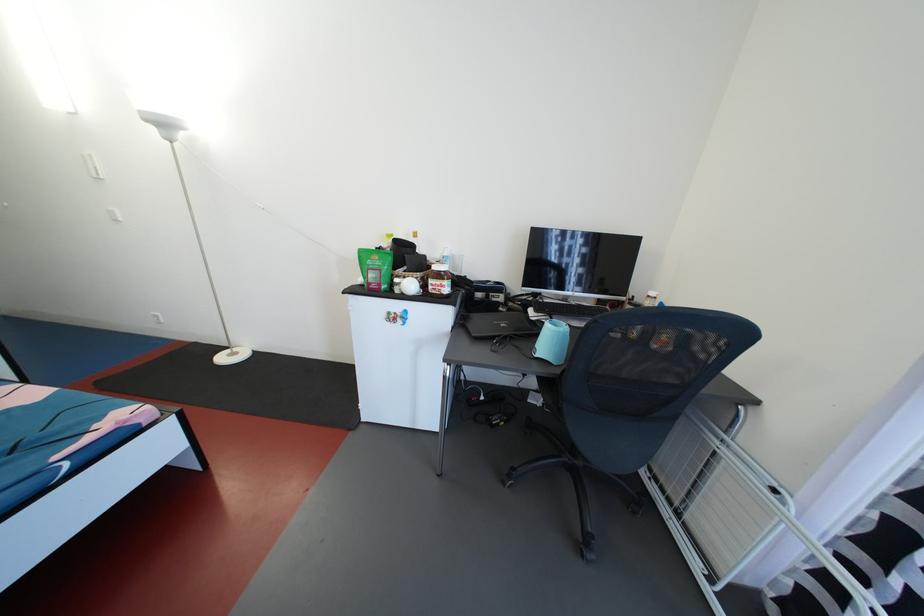
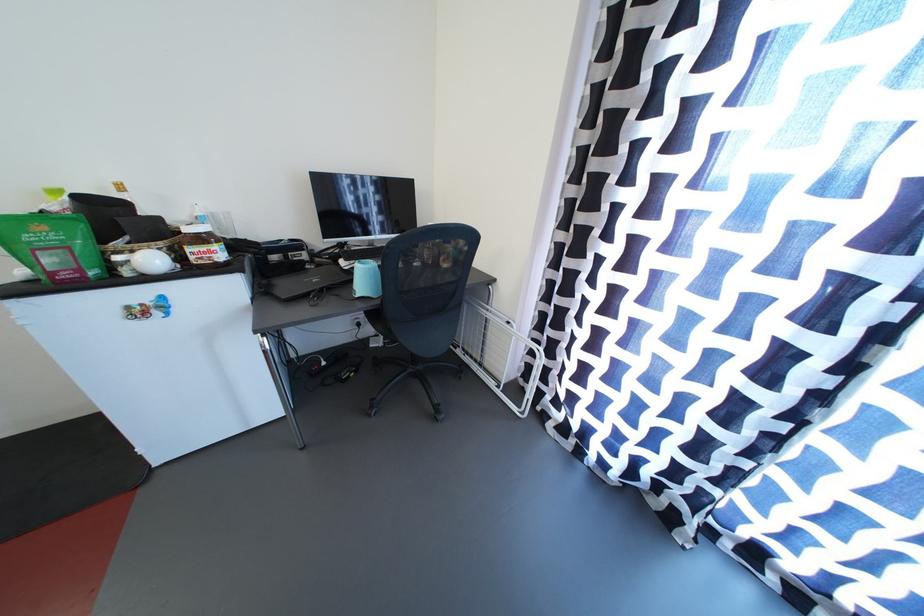
Where in the second image is the point corresponding to point (386, 275) from the first image?

(75, 253)